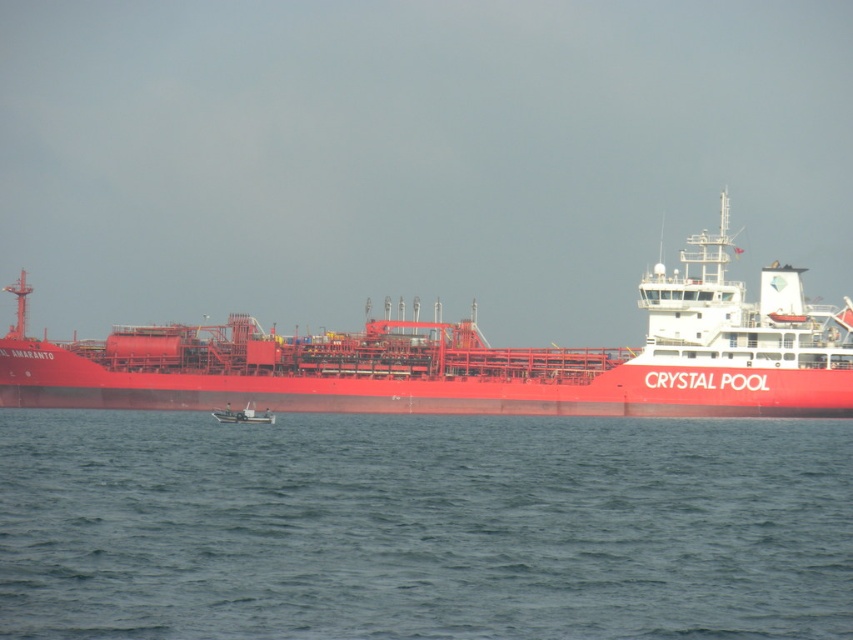
Can you confirm if metallic red ship at center is positioned to the right of metallic gray boat at center?

Correct, you'll find metallic red ship at center to the right of metallic gray boat at center.

Can you confirm if metallic red ship at center is wider than metallic gray boat at center?

Yes, metallic red ship at center is wider than metallic gray boat at center.

Between point (722, 301) and point (265, 408), which one is positioned in front?

Point (265, 408)

You are a GUI agent. You are given a task and a screenshot of the screen. Output one action in this format:
    pyautogui.click(x=<x>, y=<y>)
    Task: Click on the metallic red ship at center
    The width and height of the screenshot is (853, 640).
    Given the screenshot: What is the action you would take?
    pyautogui.click(x=476, y=358)

Who is positioned more to the right, blue water at lower center or metallic red ship at center?

Positioned to the right is blue water at lower center.

Does blue water at lower center have a lesser height compared to metallic red ship at center?

Correct, blue water at lower center is not as tall as metallic red ship at center.

What are the coordinates of `blue water at lower center` in the screenshot? It's located at (422, 525).

Based on the photo, measure the distance between point (51,410) and camera.

They are 158.53 meters apart.

Is point (154, 444) farther from camera compared to point (230, 417)?

No.

Find the location of a particular element. The image size is (853, 640). blue water at lower center is located at coordinates click(x=422, y=525).